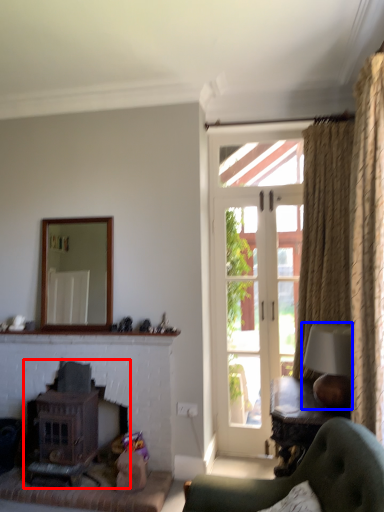
Question: Which object appears closest to the camera in this image, fireplace (highlighted by a red box) or lamp (highlighted by a blue box)?

Choices:
 (A) fireplace
 (B) lamp

Answer: (B)